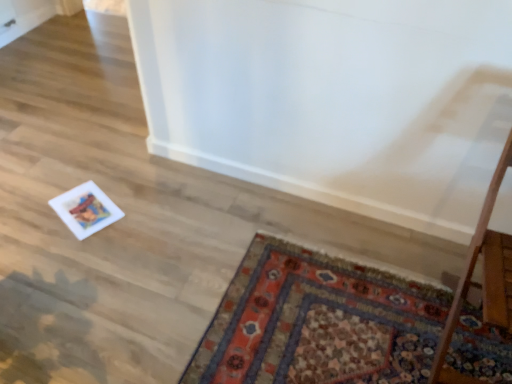
Question: Do you think wooden table at right is within carpeted mat at lower right, or outside of it?

Choices:
 (A) inside
 (B) outside

Answer: (B)

Question: In the image, is wooden table at right positioned in front of or behind carpeted mat at lower right?

Choices:
 (A) front
 (B) behind

Answer: (A)

Question: From the image's perspective, is wooden table at right located above or below carpeted mat at lower right?

Choices:
 (A) below
 (B) above

Answer: (B)

Question: From a real-world perspective, is carpeted mat at lower right positioned above or below wooden table at right?

Choices:
 (A) below
 (B) above

Answer: (A)

Question: From their relative heights in the image, would you say carpeted mat at lower right is taller or shorter than wooden table at right?

Choices:
 (A) short
 (B) tall

Answer: (A)

Question: Looking at their shapes, would you say carpeted mat at lower right is wider or thinner than wooden table at right?

Choices:
 (A) wide
 (B) thin

Answer: (A)

Question: Which is correct: carpeted mat at lower right is inside wooden table at right, or outside of it?

Choices:
 (A) inside
 (B) outside

Answer: (B)